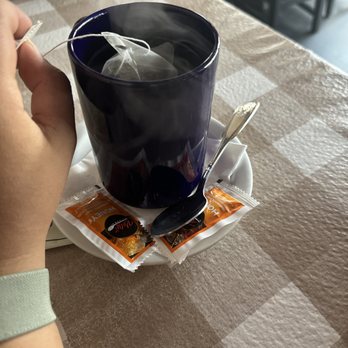
Image resolution: width=348 pixels, height=348 pixels. Find the location of `napkin`. napkin is located at coordinates (230, 164).